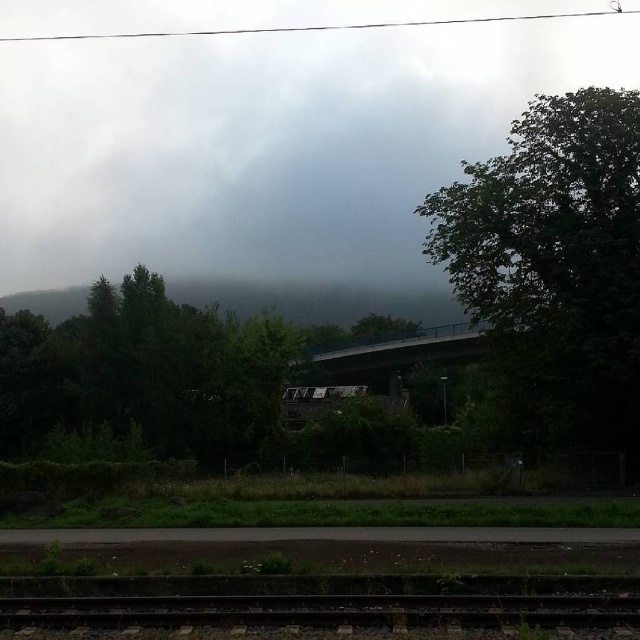
Question: Which of the following is the farthest from the observer?

Choices:
 (A) (605, 228)
 (B) (42, 97)
 (C) (444, 346)
 (D) (355, 332)

Answer: (B)

Question: Among these points, which one is nearest to the camera?

Choices:
 (A) (401, 625)
 (B) (154, 262)
 (C) (397, 330)

Answer: (A)

Question: Which object appears farthest from the camera in this image?

Choices:
 (A) green matte tree at center
 (B) green leafy tree at upper right
 (C) smooth concrete train track at bottom

Answer: (A)

Question: Where is foggy gray cloud at upper center located in relation to green leafy tree at upper right in the image?

Choices:
 (A) right
 (B) left

Answer: (B)

Question: Is foggy gray cloud at upper center closer to the viewer compared to smooth concrete train track at bottom?

Choices:
 (A) yes
 (B) no

Answer: (B)

Question: Can you confirm if foggy gray cloud at upper center is smaller than smooth concrete train track at bottom?

Choices:
 (A) no
 (B) yes

Answer: (A)